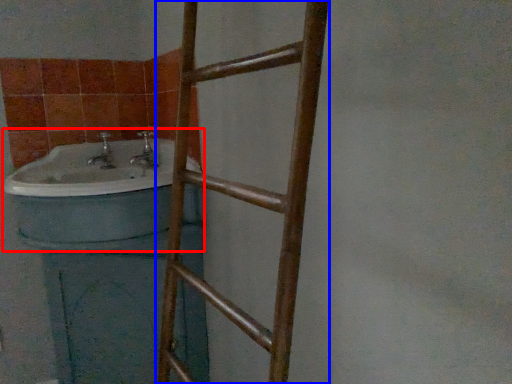
Question: Among these objects, which one is farthest to the camera, sink (highlighted by a red box) or ladder (highlighted by a blue box)?

Choices:
 (A) sink
 (B) ladder

Answer: (A)